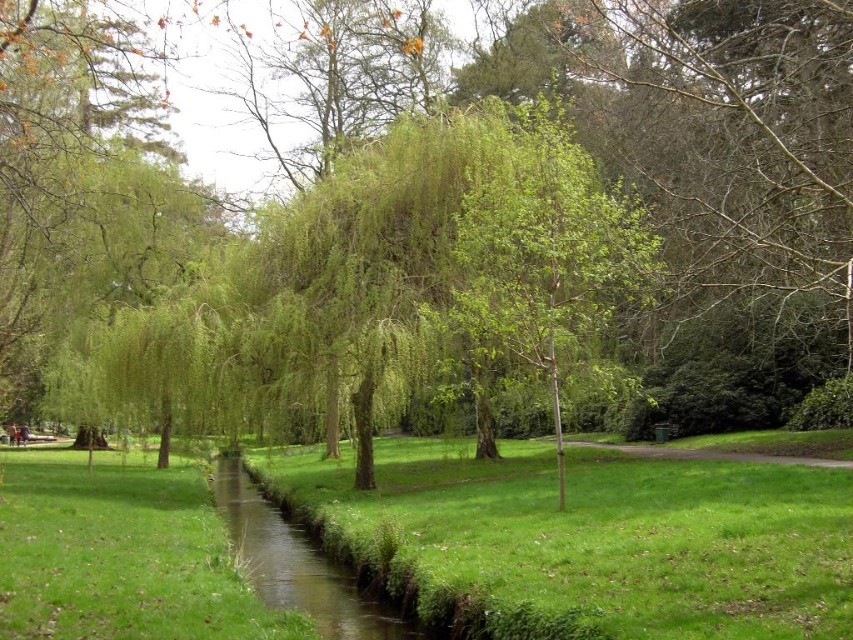
Question: Estimate the real-world distances between objects in this image. Which object is farther from the green grassy at center?

Choices:
 (A) green leafy willow at center
 (B) green grassy waterway at center

Answer: (A)

Question: Which point is closer to the camera taking this photo?

Choices:
 (A) pos(241,493)
 (B) pos(555,620)
 (C) pos(376,394)

Answer: (B)

Question: Does green leafy willow at center have a greater width compared to green grassy waterway at center?

Choices:
 (A) no
 (B) yes

Answer: (B)

Question: Does green leafy willow at center have a larger size compared to green grassy waterway at center?

Choices:
 (A) yes
 (B) no

Answer: (A)

Question: Does green leafy willow at center appear on the right side of green grassy at center?

Choices:
 (A) no
 (B) yes

Answer: (A)

Question: Which point is closer to the camera?

Choices:
 (A) (390, 339)
 (B) (370, 509)

Answer: (A)